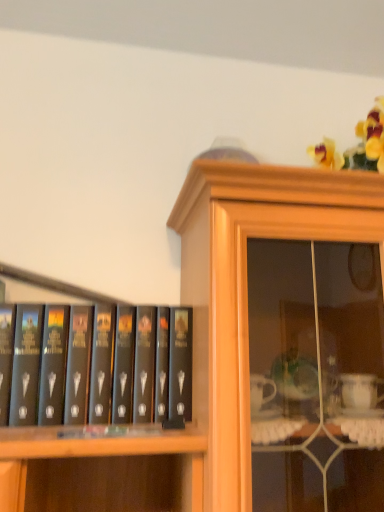
Describe the element at coordinates (94, 364) in the screenshot. I see `black matte book at left` at that location.

Find the location of a particular element. black matte book at left is located at coordinates (94, 364).

In order to click on black matte book at left in this screenshot , I will do `click(94, 364)`.